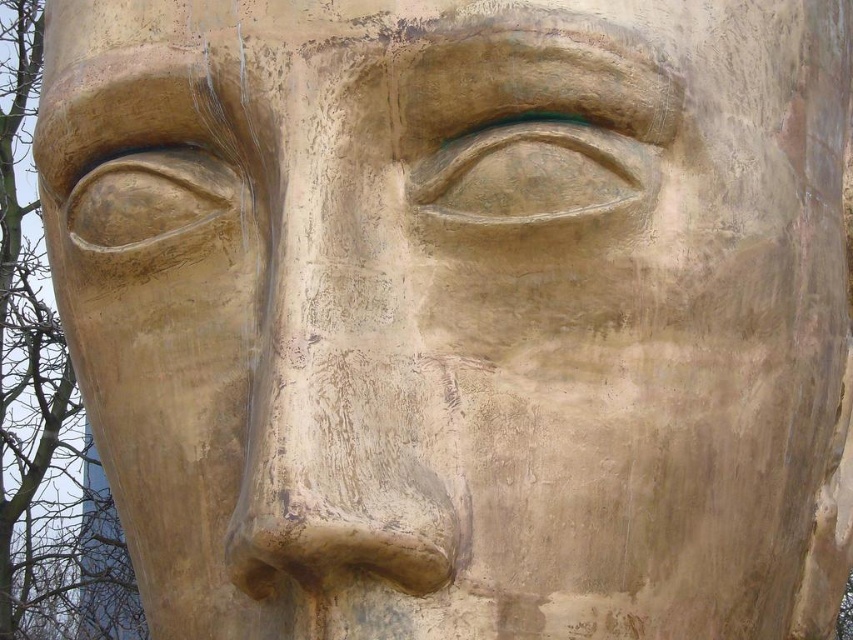
Question: From the image, what is the correct spatial relationship of matte gold nose at center in relation to matte gold eye at center?

Choices:
 (A) below
 (B) above

Answer: (A)

Question: Considering the relative positions of matte gold nose at center and matte gold eye at center in the image provided, where is matte gold nose at center located with respect to matte gold eye at center?

Choices:
 (A) left
 (B) right

Answer: (A)

Question: Does matte gold nose at center appear under matte gold eye at center?

Choices:
 (A) no
 (B) yes

Answer: (B)